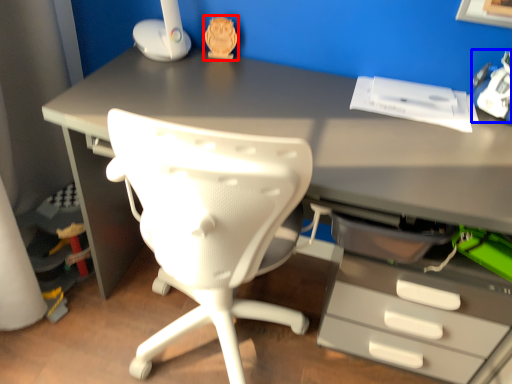
Question: Which object appears farthest to the camera in this image, toy (highlighted by a red box) or toy (highlighted by a blue box)?

Choices:
 (A) toy
 (B) toy

Answer: (A)